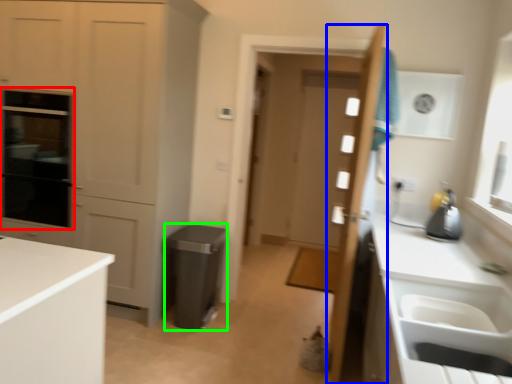
Question: Which is nearer to the oven (highlighted by a red box)? door (highlighted by a blue box) or appliance (highlighted by a green box).

Choices:
 (A) door
 (B) appliance

Answer: (B)